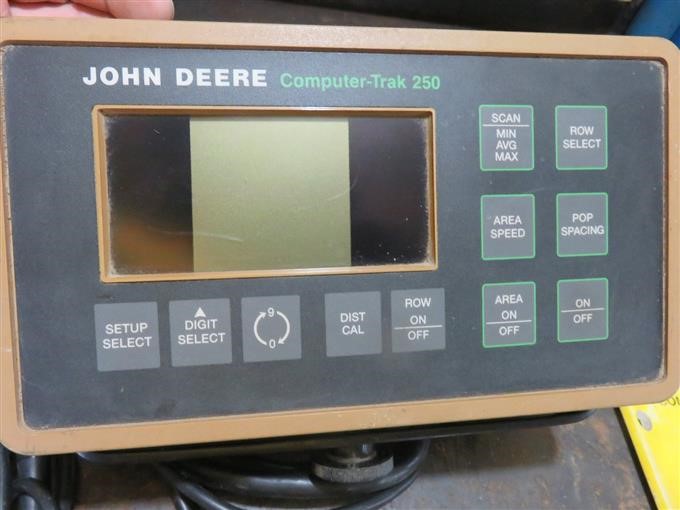
The width and height of the screenshot is (680, 510). Find the location of `on/off buttons`. on/off buttons is located at coordinates (424, 322), (513, 321), (585, 309).